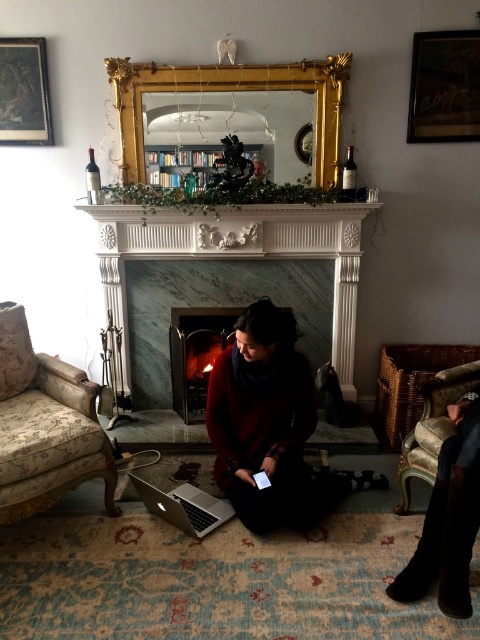
Question: Among these objects, which one is nearest to the camera?

Choices:
 (A) wooden framed artwork at upper right
 (B) matte black picture frame at upper left
 (C) green marble fireplace at center
 (D) matte black fireplace at center

Answer: (A)

Question: Is green marble fireplace at center wider than floral fabric armchair at left?

Choices:
 (A) no
 (B) yes

Answer: (B)

Question: Which of the following is the farthest from the observer?

Choices:
 (A) (26, 428)
 (B) (19, 90)

Answer: (B)

Question: Which is farther from the matte black fireplace at center?

Choices:
 (A) woven fabric armchair at lower right
 (B) silver metallic laptop at lower center
 (C) wooden framed artwork at upper right
 (D) matte black picture frame at upper left

Answer: (C)

Question: Does green marble fireplace at center have a lesser width compared to wooden framed artwork at upper right?

Choices:
 (A) no
 (B) yes

Answer: (A)

Question: Can you confirm if wooden framed artwork at upper right is positioned below woven fabric armchair at lower right?

Choices:
 (A) no
 (B) yes

Answer: (A)